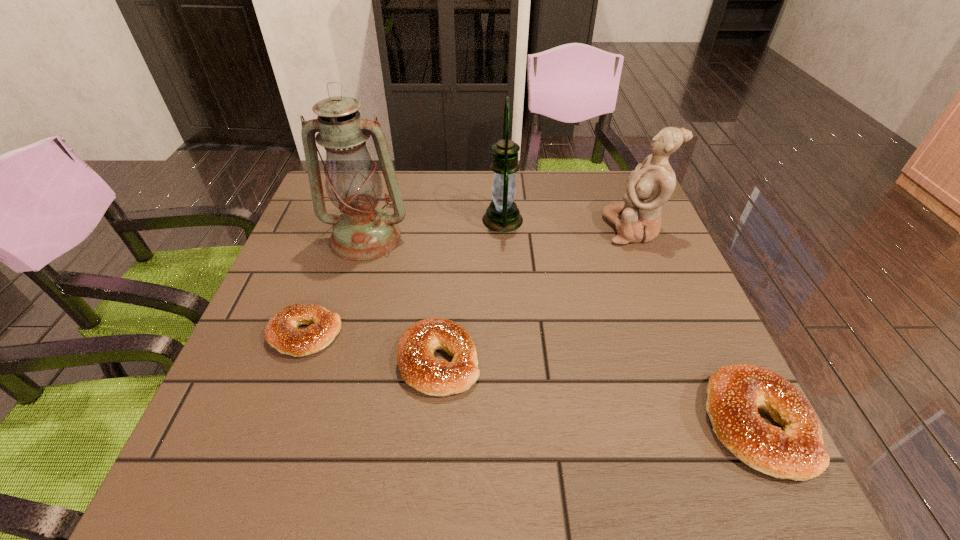
At what (x,y) coordinates should I click in order to perform the action: click on free space between the figurine and the rightmost bagel. Please return your answer as a coordinate pair (x, y). Looking at the image, I should click on (695, 327).

Where is `vacant area that lies between the oil lamp and the fourth object from left to right`? The width and height of the screenshot is (960, 540). vacant area that lies between the oil lamp and the fourth object from left to right is located at coordinates (434, 229).

Where is `unoccupied area between the third tallest object and the oil lamp`? Image resolution: width=960 pixels, height=540 pixels. unoccupied area between the third tallest object and the oil lamp is located at coordinates (499, 233).

Image resolution: width=960 pixels, height=540 pixels. Identify the location of free area in between the fourth object from left to right and the shortest bagel. (404, 277).

This screenshot has height=540, width=960. Find the location of `object that stands as the fourth closest to the oil lamp`. object that stands as the fourth closest to the oil lamp is located at coordinates (652, 183).

The image size is (960, 540). Find the location of `object that is the fifth closest to the fifth shortest object`. object that is the fifth closest to the fifth shortest object is located at coordinates tap(735, 392).

I want to click on bagel that is the third closest one to the figurine, so click(281, 332).

Identify which bagel is the second closest to the third object from right to left. Please provide its 2D coordinates. Your answer should be formatted as a tuple, i.e. [(x, y)], where the tuple contains the x and y coordinates of a point satisfying the conditions above.

[(281, 332)]

At what (x,y) coordinates should I click in order to perform the action: click on free spot that satisfies the following two spatial constraints: 1. on the side where the second tallest object emits light; 2. on the front side of the shortest bagel. Please return your answer as a coordinate pair (x, y). The height and width of the screenshot is (540, 960). Looking at the image, I should click on (510, 334).

Locate an element on the screen. The width and height of the screenshot is (960, 540). vacant area that satisfies the following two spatial constraints: 1. on the side where the fourth object from left to right emits light; 2. on the front side of the second shortest object is located at coordinates (511, 361).